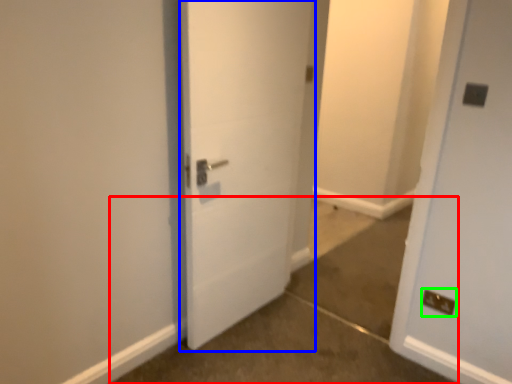
Question: Which object is positioned closest to concrete (highlighted by a red box)? Select from door (highlighted by a blue box) and electric outlet (highlighted by a green box).

Choices:
 (A) door
 (B) electric outlet

Answer: (B)